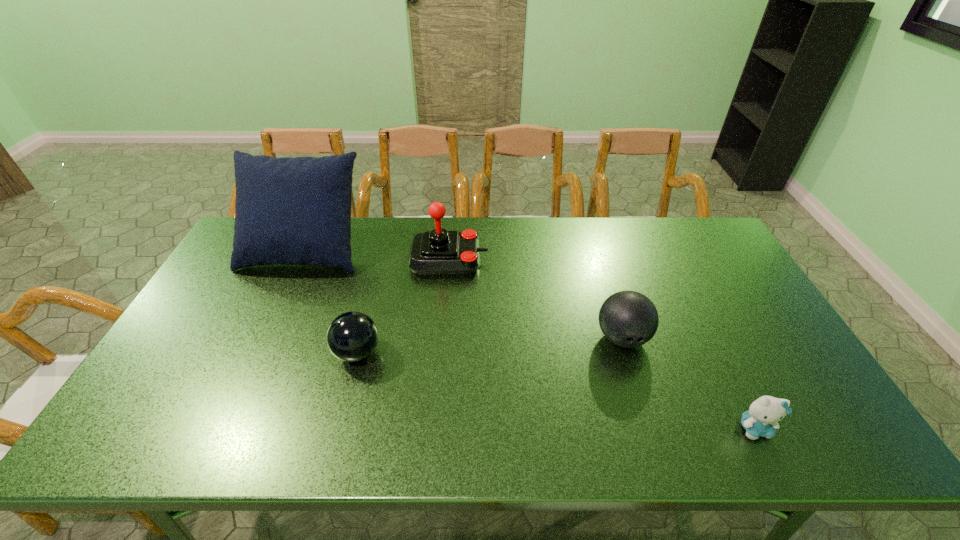
The image size is (960, 540). I want to click on free point located on the base of the second tallest object, so click(x=517, y=259).

Identify the location of vacant space located 0.180m on the grip area of the second object from right to left. (648, 422).

You are a GUI agent. You are given a task and a screenshot of the screen. Output one action in this format:
    pyautogui.click(x=<x>, y=<y>)
    Task: Click on the vacant area situated 0.100m on the side of the left bowling ball with the finger holes
    
    Given the screenshot: What is the action you would take?
    pyautogui.click(x=419, y=353)

Image resolution: width=960 pixels, height=540 pixels. I want to click on cushion present at the far edge, so click(x=289, y=211).

You are a GUI agent. You are given a task and a screenshot of the screen. Output one action in this format:
    pyautogui.click(x=<x>, y=<y>)
    Task: Click on the joystick that is at the far edge
    The image size is (960, 540).
    Given the screenshot: What is the action you would take?
    pyautogui.click(x=437, y=252)

The image size is (960, 540). What are the coordinates of `object situated at the near edge` in the screenshot? It's located at (761, 419).

Find the location of a particular element. This screenshot has width=960, height=540. object that is at the left edge is located at coordinates (289, 211).

Where is `object at the right edge`? This screenshot has width=960, height=540. object at the right edge is located at coordinates (761, 419).

Identify the location of object present at the far left corner. (x=289, y=211).

The image size is (960, 540). I want to click on object that is at the near right corner, so click(761, 419).